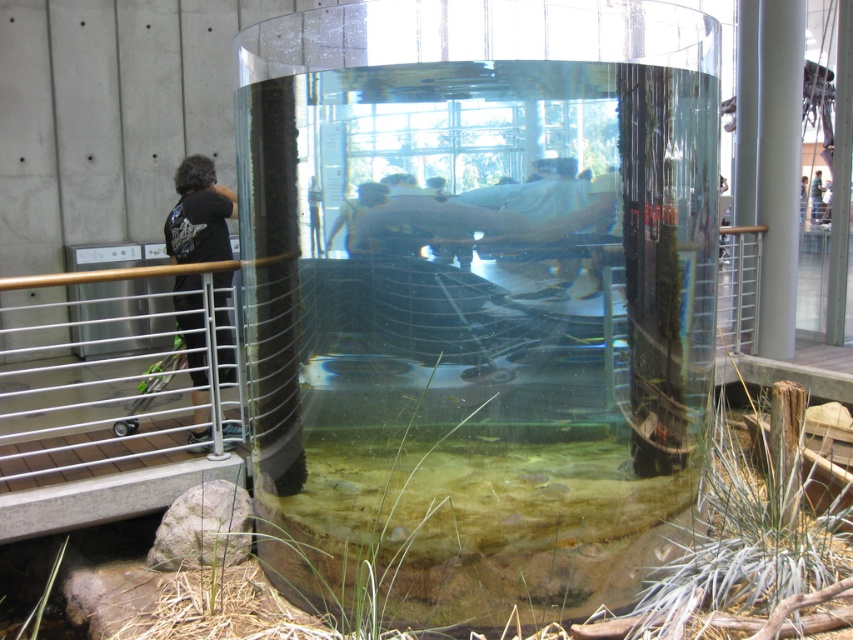
Question: Can you confirm if black fabric shirt at left is positioned to the right of light blue shirt at upper center?

Choices:
 (A) no
 (B) yes

Answer: (A)

Question: Which object is the farthest from the matte black shirt at center?

Choices:
 (A) light blue shirt at upper center
 (B) clear glass water tank at center

Answer: (A)

Question: Is black fabric shirt at left smaller than light blue shirt at upper center?

Choices:
 (A) yes
 (B) no

Answer: (A)

Question: Which object is closer to the camera taking this photo?

Choices:
 (A) black fabric shirt at left
 (B) light blue shirt at upper center

Answer: (A)

Question: Which is farther from the light blue shirt at upper center?

Choices:
 (A) black fabric shirt at left
 (B) matte black shirt at center

Answer: (B)

Question: Can you confirm if matte black shirt at center is positioned above light blue shirt at upper center?

Choices:
 (A) yes
 (B) no

Answer: (B)